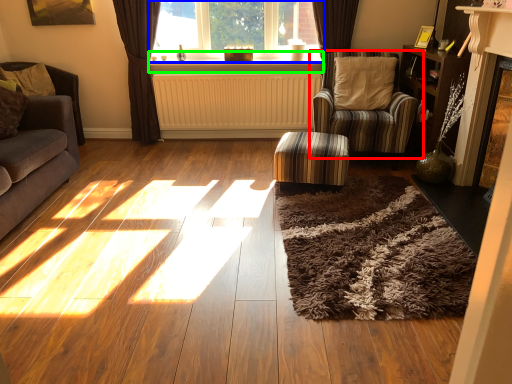
Question: Which is nearer to the chair (highlighted by a red box)? window (highlighted by a blue box) or window sill (highlighted by a green box).

Choices:
 (A) window
 (B) window sill

Answer: (B)